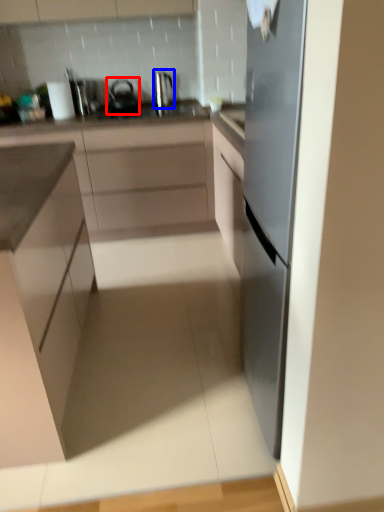
Question: Which object is further to the camera taking this photo, tea pot (highlighted by a red box) or kitchen appliance (highlighted by a blue box)?

Choices:
 (A) tea pot
 (B) kitchen appliance

Answer: (B)